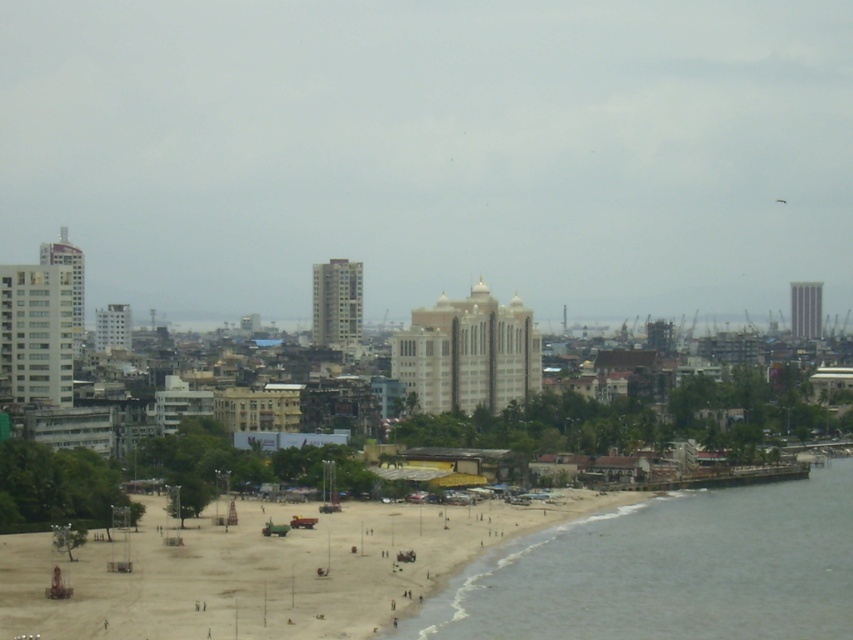
Question: Does matte white building at center appear on the right side of brown sand beach at lower right?

Choices:
 (A) yes
 (B) no

Answer: (A)

Question: Estimate the real-world distances between objects in this image. Which object is farther from the brown sand beach at lower right?

Choices:
 (A) matte white building at center
 (B) grayish-green water at beach right

Answer: (A)

Question: Based on their relative distances, which object is farther from the brown sand beach at lower right?

Choices:
 (A) matte white building at center
 (B) grayish-green water at beach right

Answer: (A)

Question: Considering the relative positions of matte white building at center and grayish-green water at beach right in the image provided, where is matte white building at center located with respect to grayish-green water at beach right?

Choices:
 (A) left
 (B) right

Answer: (A)

Question: Can you confirm if matte white building at center is positioned to the right of grayish-green water at beach right?

Choices:
 (A) yes
 (B) no

Answer: (B)

Question: Which point is farther to the camera?

Choices:
 (A) brown sand beach at lower right
 (B) matte white building at center
 (C) grayish-green water at beach right

Answer: (C)